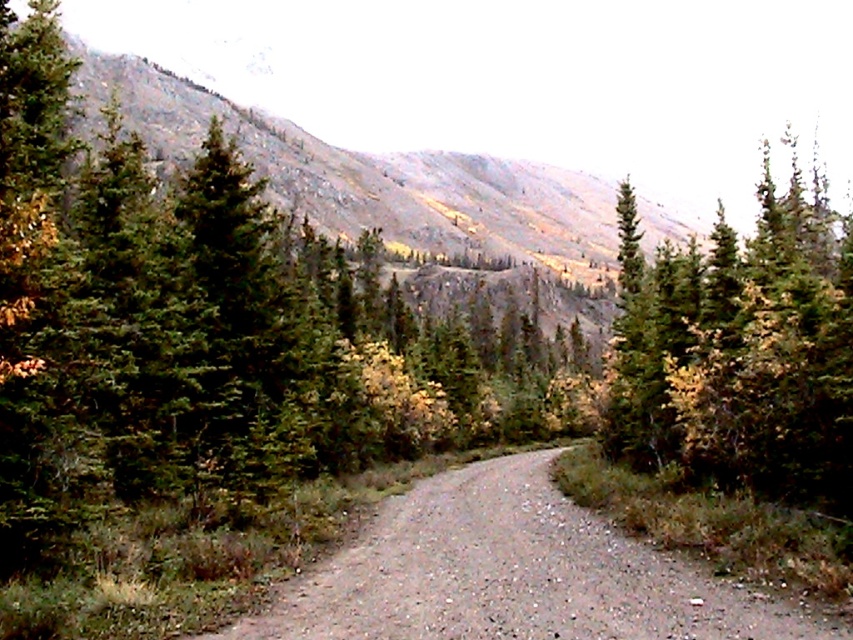
Question: Can you confirm if green matte tree at upper right is positioned to the right of gray gravel trail at center?

Choices:
 (A) no
 (B) yes

Answer: (B)

Question: Is green matte tree at upper right thinner than gray gravel trail at center?

Choices:
 (A) no
 (B) yes

Answer: (A)

Question: Which point is closer to the camera?

Choices:
 (A) (387, 582)
 (B) (682, 317)

Answer: (A)

Question: Observing the image, what is the correct spatial positioning of green matte tree at upper right in reference to gray gravel trail at center?

Choices:
 (A) below
 (B) above

Answer: (B)

Question: Which of the following is the farthest from the observer?

Choices:
 (A) (564, 636)
 (B) (674, 260)

Answer: (B)